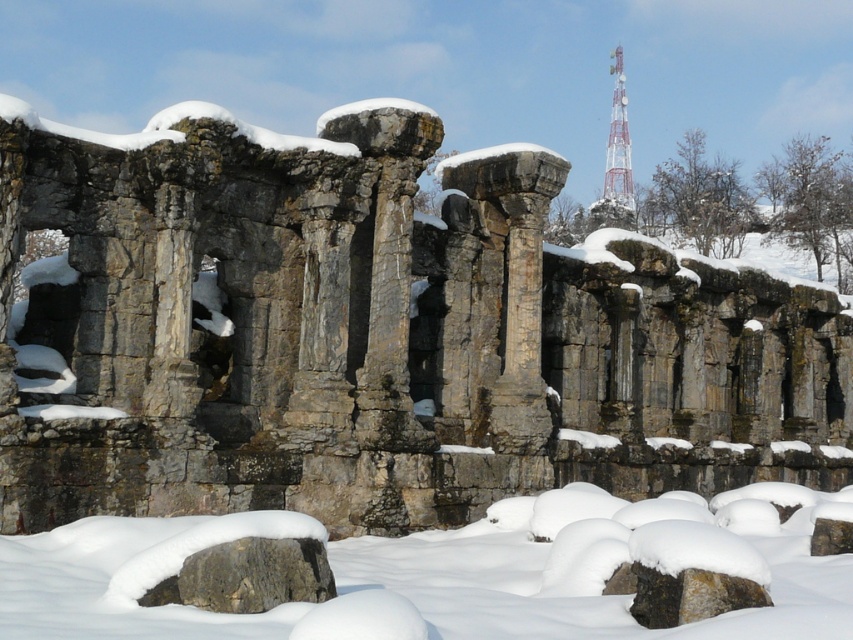
You are a photographer planning to capture the rusty stone columns at center and the white metallic tower at upper right in the same frame. Based on their positions, which object would appear larger in your photo?

The rusty stone columns at center would appear larger in the photo because they are closer to the viewer than the white metallic tower at upper right.

You are a photographer planning to capture a symmetrical composition of the white fluffy snow at center and the white metallic tower at upper right. Since you want the two objects to be aligned horizontally, which one should you move your camera to the right to include in the frame first?

The white fluffy snow at center is positioned on the left side of white metallic tower at upper right. To include both in a symmetrical composition, you should first move your camera to the right to include the white metallic tower at upper right since it is on the right side of the white fluffy snow at center.